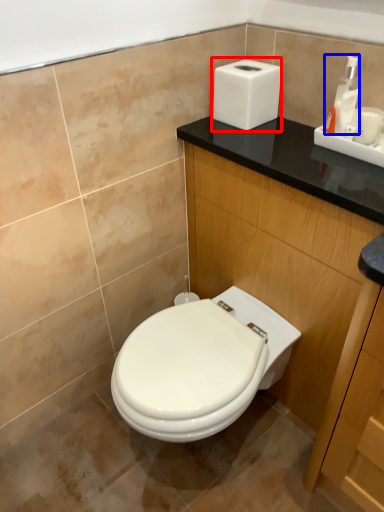
Question: Which point is closer to the camera, hand dryer (highlighted by a red box) or soap dispenser (highlighted by a blue box)?

Choices:
 (A) hand dryer
 (B) soap dispenser

Answer: (B)